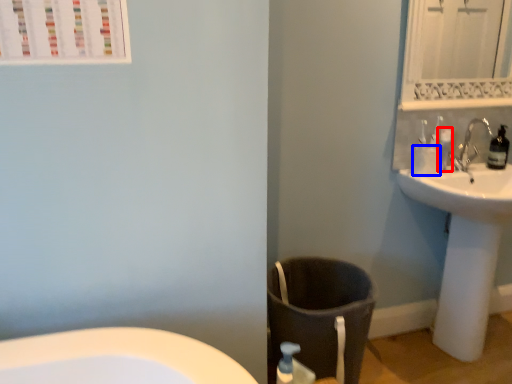
Question: Which of the following is the farthest to the observer, toiletry (highlighted by a red box) or toilet paper (highlighted by a blue box)?

Choices:
 (A) toiletry
 (B) toilet paper

Answer: (A)